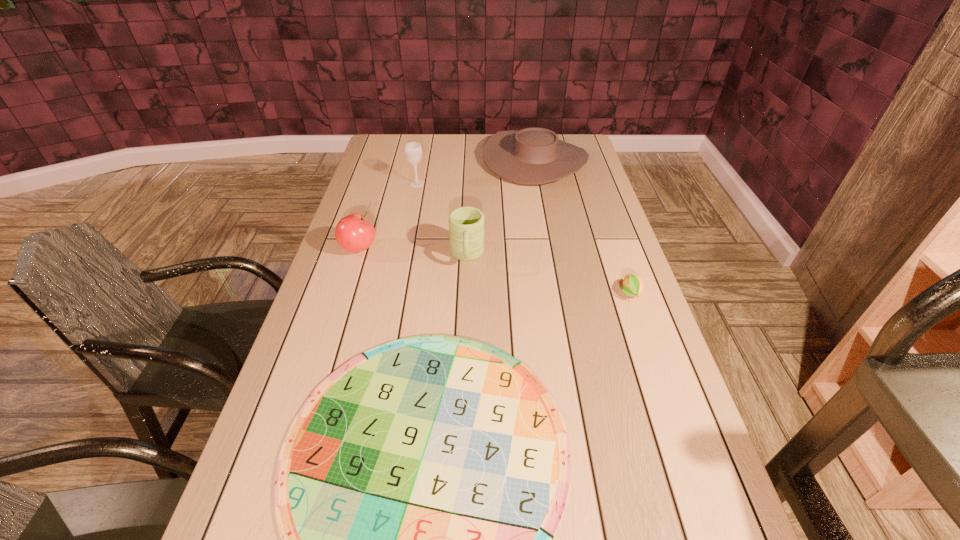
You are a GUI agent. You are given a task and a screenshot of the screen. Output one action in this format:
    pyautogui.click(x=<x>, y=<y>)
    Task: Click on the wineglass
    
    Given the screenshot: What is the action you would take?
    pyautogui.click(x=413, y=150)

I want to click on mug, so click(466, 224).

The image size is (960, 540). What are the coordinates of `apple` in the screenshot? It's located at (354, 233).

The width and height of the screenshot is (960, 540). I want to click on cowboy hat, so click(x=534, y=155).

Where is `lemon`? This screenshot has height=540, width=960. lemon is located at coordinates (633, 285).

Where is `the second shortest object`? Image resolution: width=960 pixels, height=540 pixels. the second shortest object is located at coordinates (633, 285).

Find the location of `vacant position located on the right of the wineglass`. vacant position located on the right of the wineglass is located at coordinates (472, 184).

Where is `free space located 0.110m on the side of the mug with the handle`? Image resolution: width=960 pixels, height=540 pixels. free space located 0.110m on the side of the mug with the handle is located at coordinates (466, 300).

The height and width of the screenshot is (540, 960). I want to click on vacant space positioned 0.400m on the front of the apple, so click(x=319, y=374).

This screenshot has width=960, height=540. What are the coordinates of `vacant space located 0.180m on the left of the cowboy hat` in the screenshot? It's located at (437, 161).